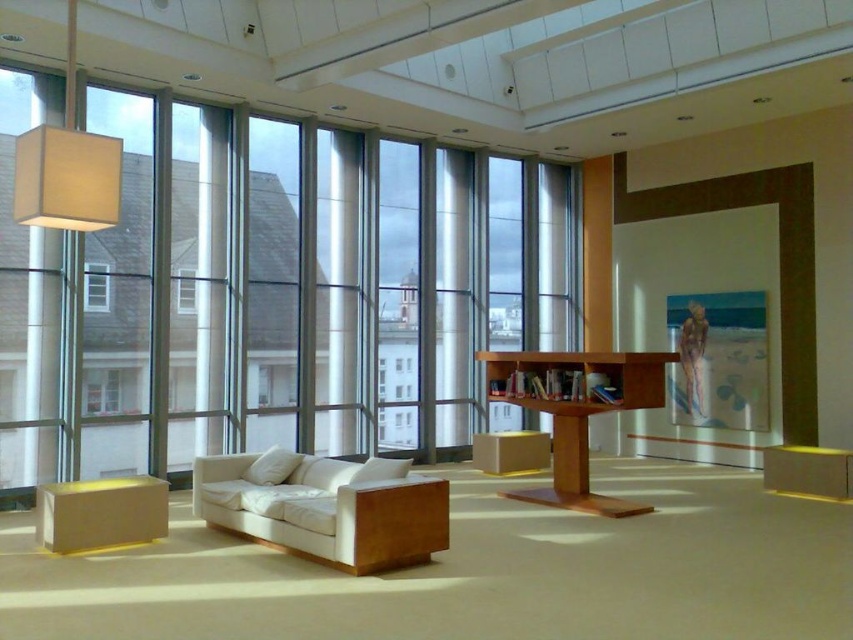
You are standing at point (193, 291) and want to walk to point (485, 468). Is the path between these two points clear of any obstacles?

Point (485, 468) is behind point (193, 291), so the path between them is clear of obstacles.

You are standing in the lounge and want to place a large potted plant between the light brown wooden bookshelf at center and the matte wood bookshelf at center. Which bookshelf should the plant be closer to if you want it to be near the sofa?

The light brown wooden bookshelf at center is closer to the viewer than the matte wood bookshelf at center, so placing the plant closer to the light brown wooden bookshelf at center would position it nearer to the sofa.

You are designing a layout for this space and need to place a tall floor lamp. The lamp requires a minimum of 1.8 meters of vertical clearance. Based on the height of the light brown wooden bookshelf at center and the matte wood bookshelf at center, which one is more suitable to place the lamp next to?

The light brown wooden bookshelf at center is taller than the matte wood bookshelf at center, so placing the tall floor lamp next to the light brown wooden bookshelf at center would provide the necessary vertical clearance of 1.8 meters.